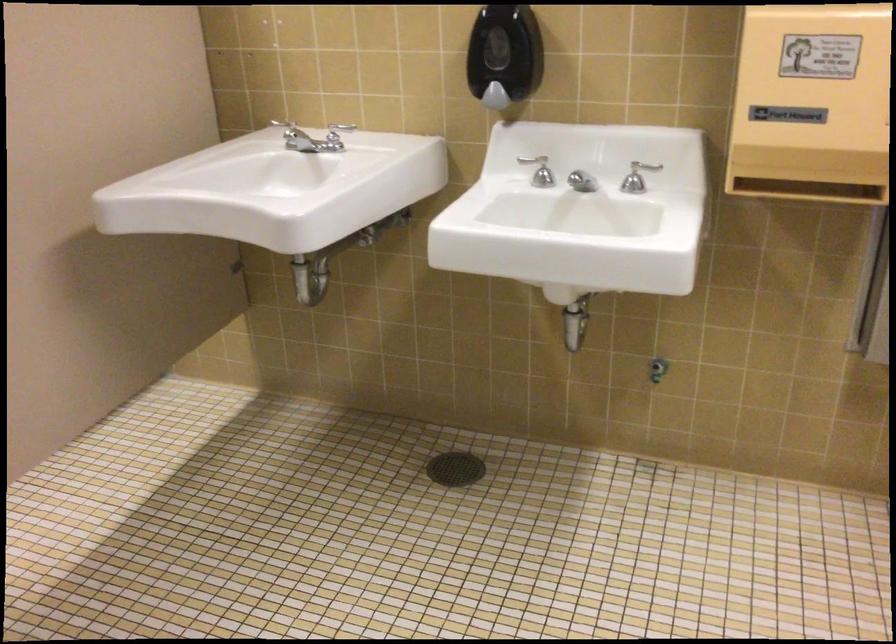
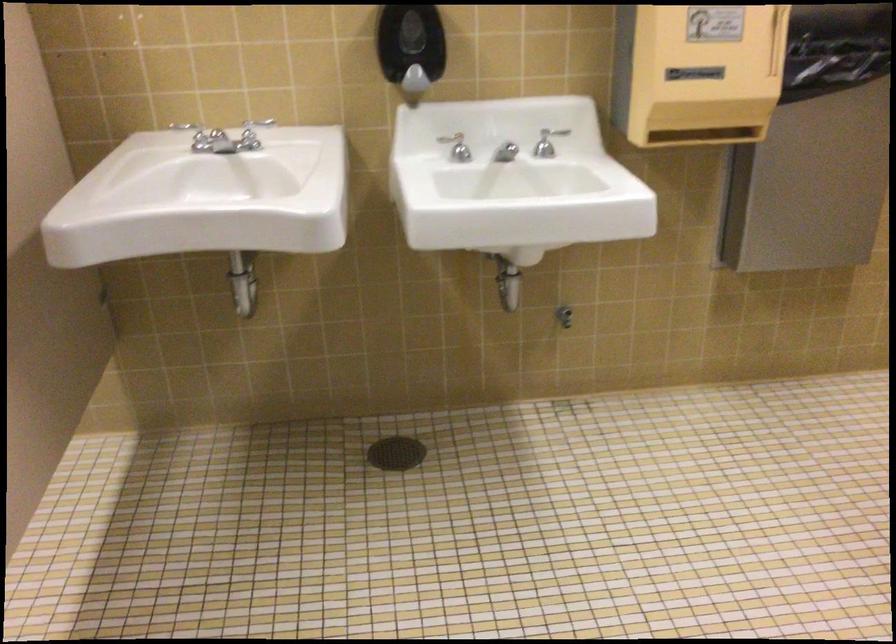
The point at (x=458, y=464) is marked in the first image. Where is the corresponding point in the second image?

(395, 453)